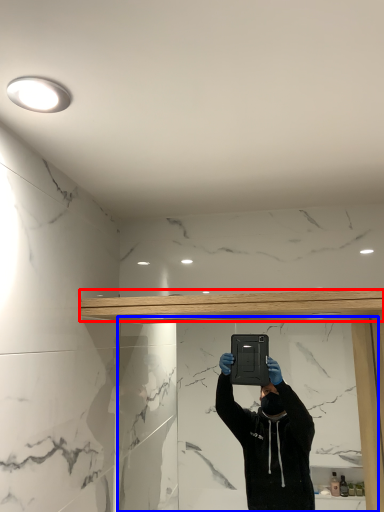
Question: Which point is closer to the camera, beam (highlighted by a red box) or mirror (highlighted by a blue box)?

Choices:
 (A) beam
 (B) mirror

Answer: (A)